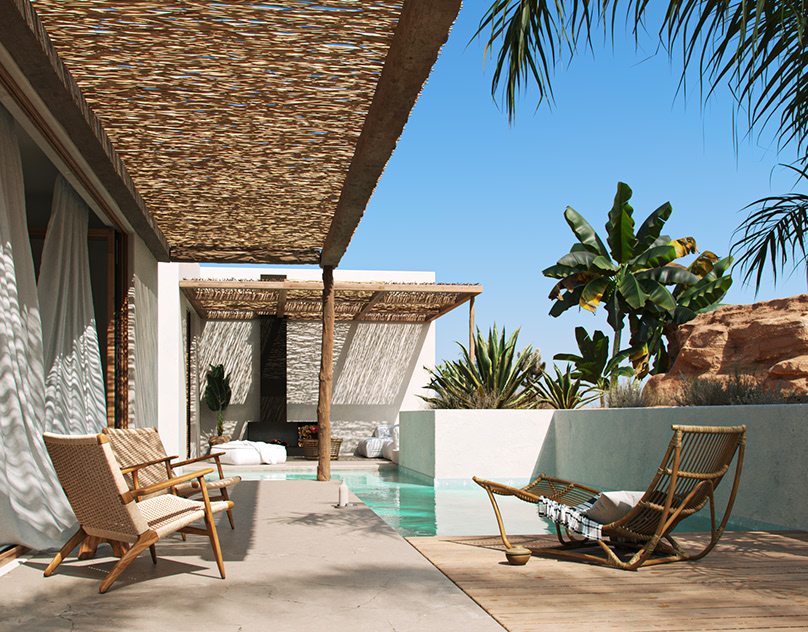
Locate an element on the screen. The image size is (808, 632). bottle on the flooring is located at coordinates (343, 499).